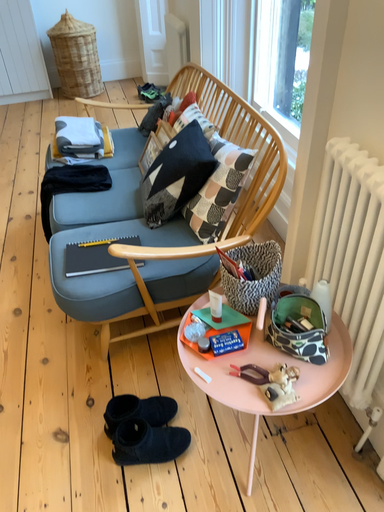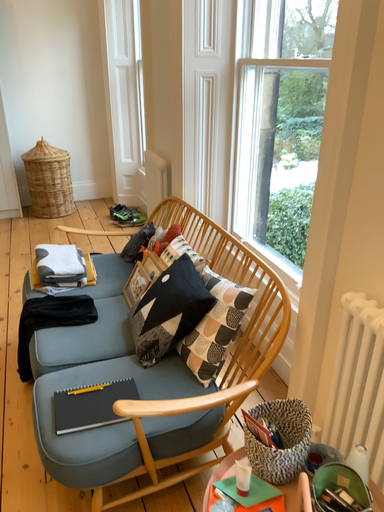
Question: How did the camera likely rotate when shooting the video?

Choices:
 (A) rotated downward
 (B) rotated upward

Answer: (B)